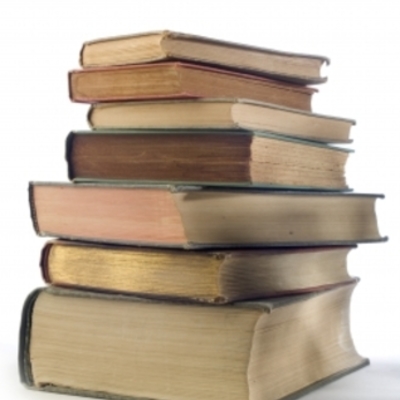
This screenshot has width=400, height=400. What are the coordinates of `books` in the screenshot? It's located at (136, 370), (169, 262), (147, 221), (194, 154), (200, 118), (158, 81), (184, 49).